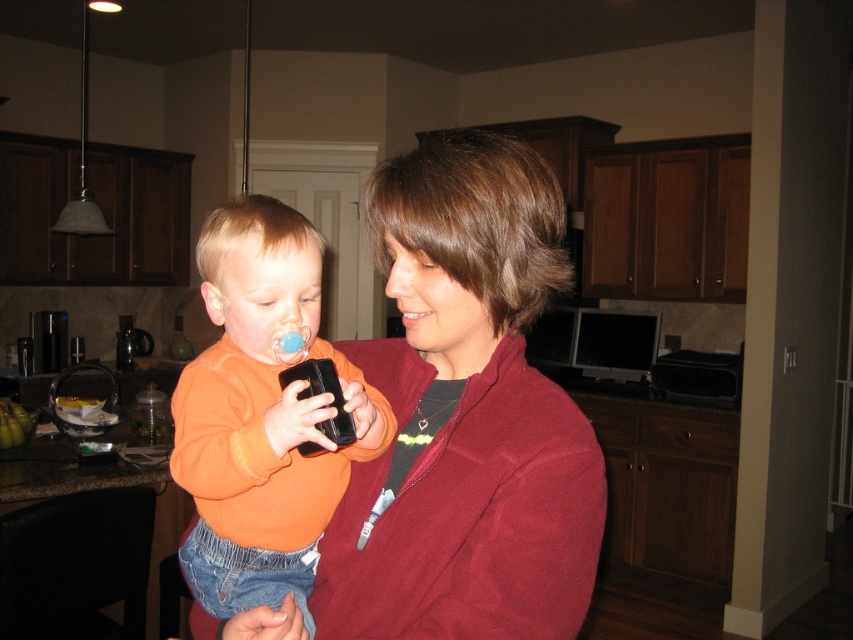
The image size is (853, 640). Describe the element at coordinates (465, 413) in the screenshot. I see `maroon fleece jacket at center` at that location.

Is point (451, 445) closer to viewer compared to point (242, 385)?

Yes.

The image size is (853, 640). I want to click on maroon fleece jacket at center, so click(x=465, y=413).